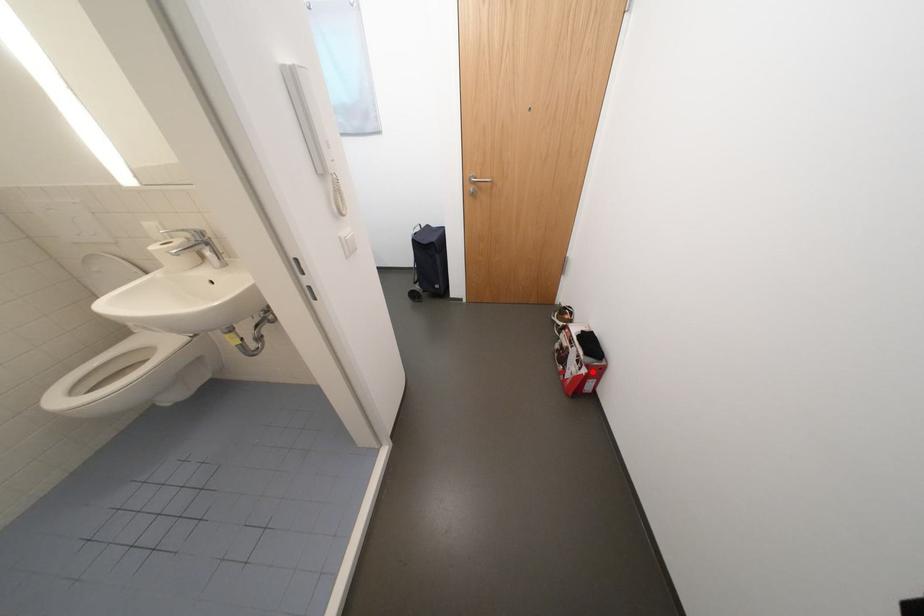
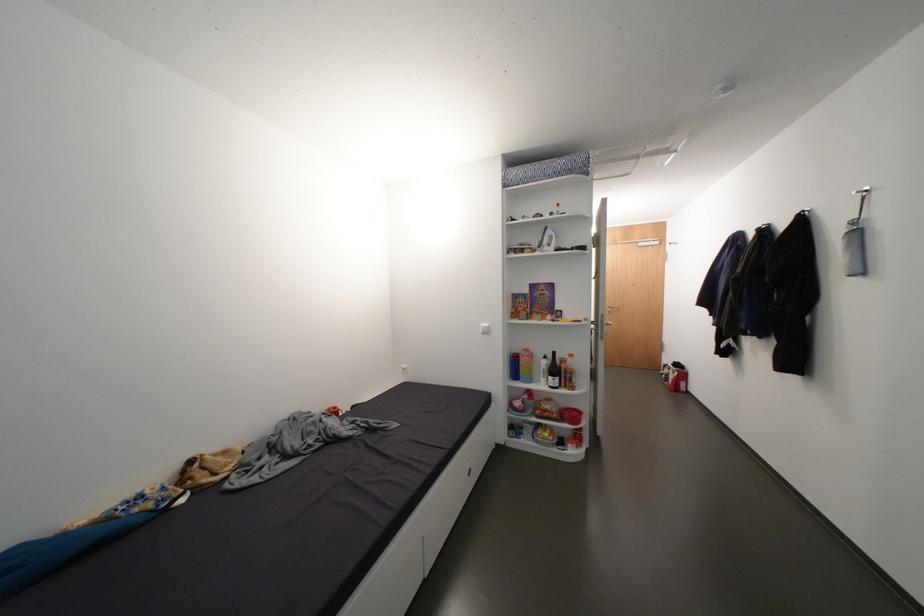
In the second image, find the point that corresponds to the highlighted location in the first image.

(684, 374)